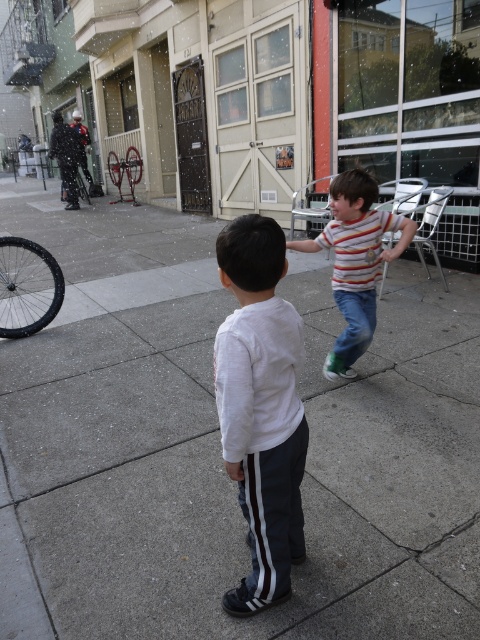
Question: Among these points, which one is farthest from the camera?

Choices:
 (A) (46, 580)
 (B) (267, 413)
 (C) (51, 256)

Answer: (C)

Question: Which point is closer to the camera?

Choices:
 (A) (253, 496)
 (B) (171, 518)
 (C) (36, 284)
 (D) (377, 212)

Answer: (A)

Question: Which point appears farthest from the camera in this image?

Choices:
 (A) (336, 452)
 (B) (231, 356)
 (C) (34, 273)
 (D) (350, 214)

Answer: (C)

Question: Observing the image, what is the correct spatial positioning of gray concrete pavement at center in reference to striped cotton shirt at center?

Choices:
 (A) below
 (B) above

Answer: (A)

Question: Is gray concrete pavement at center above striped cotton shirt at center?

Choices:
 (A) no
 (B) yes

Answer: (A)

Question: Is white matte shirt at center to the left of black rubber tire at left from the viewer's perspective?

Choices:
 (A) yes
 (B) no

Answer: (B)